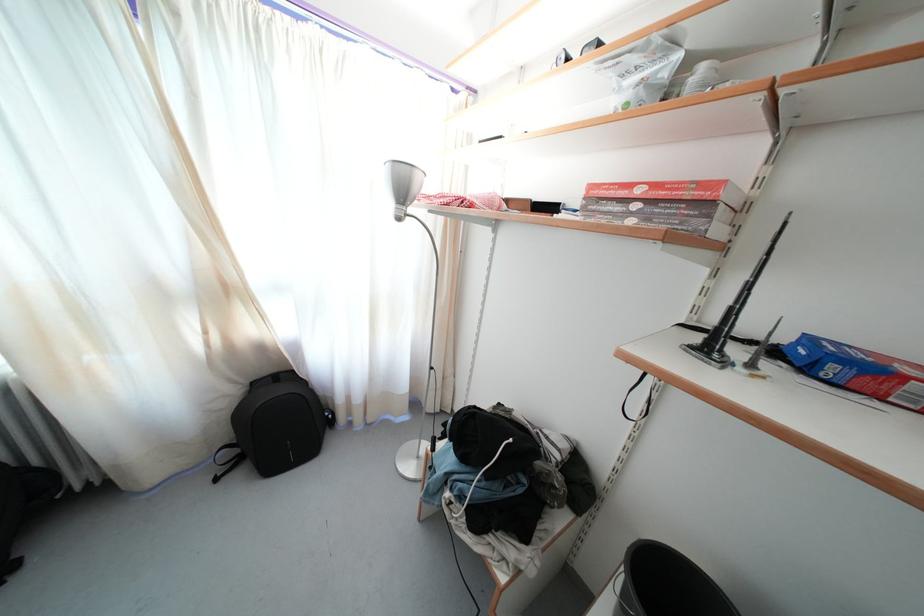
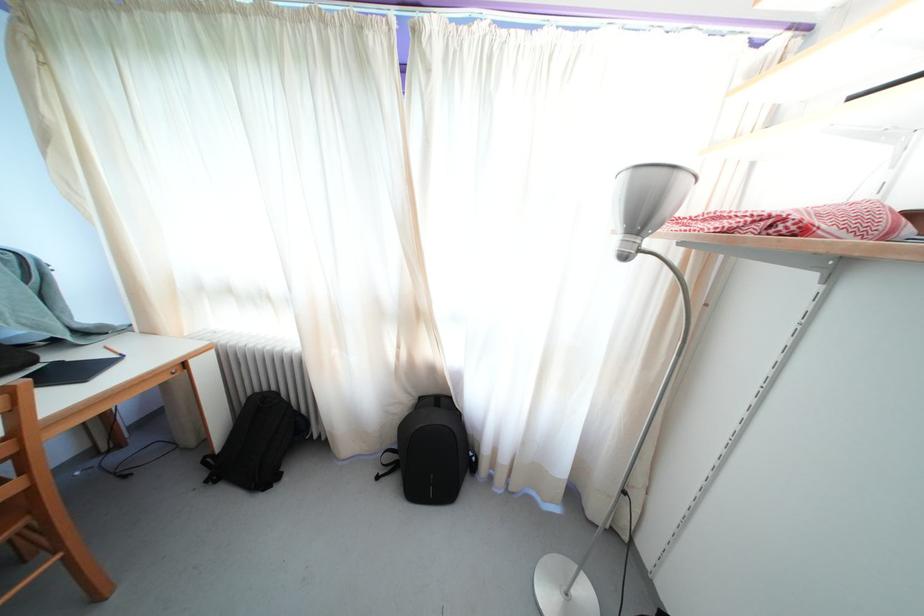
Locate, in the second image, the point that corresponds to (x=259, y=390) in the first image.

(427, 405)